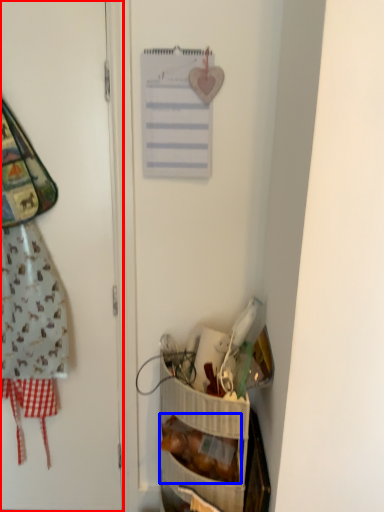
Question: Among these objects, which one is farthest to the camera, door (highlighted by a red box) or food (highlighted by a blue box)?

Choices:
 (A) door
 (B) food

Answer: (B)